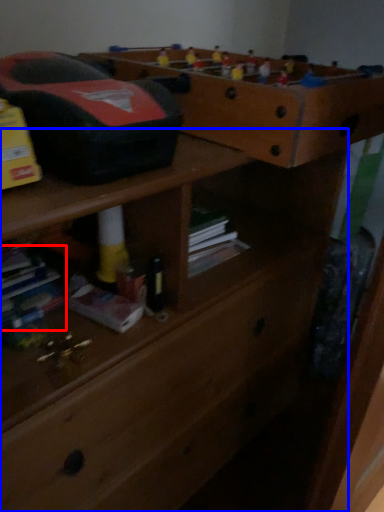
Question: Which of the following is the farthest to the observer, book (highlighted by a red box) or chest of drawers (highlighted by a blue box)?

Choices:
 (A) book
 (B) chest of drawers

Answer: (A)